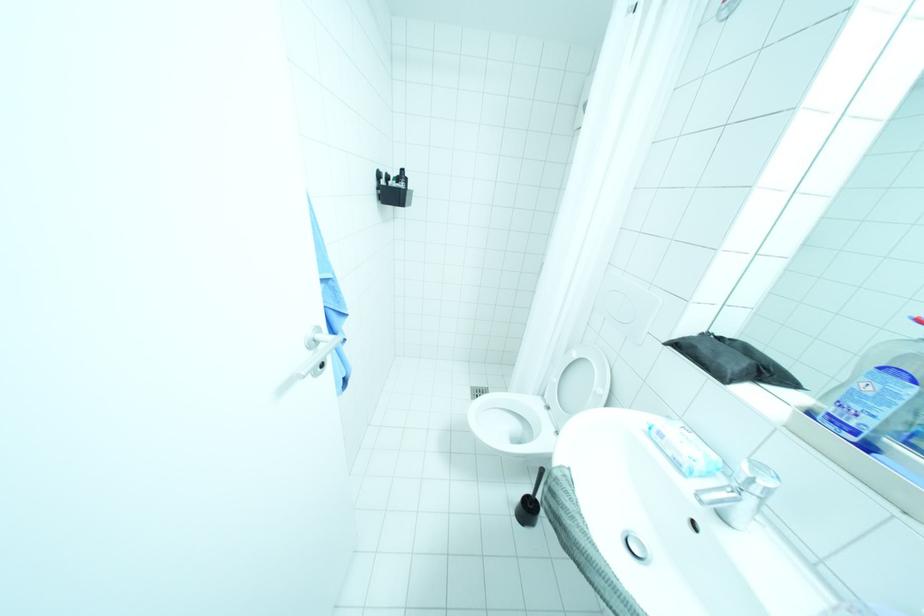
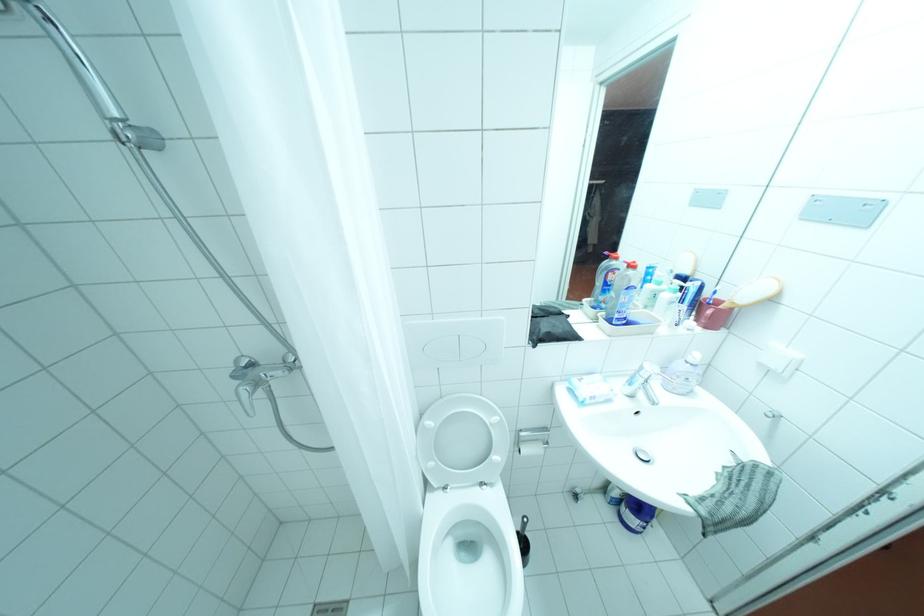
In the second image, find the point that corresponds to point (556, 407) in the first image.

(455, 487)